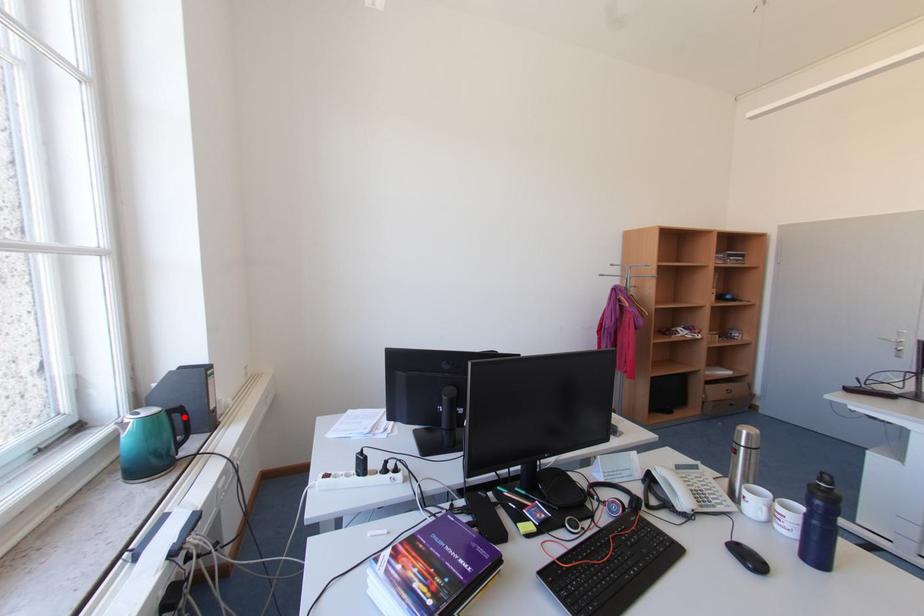
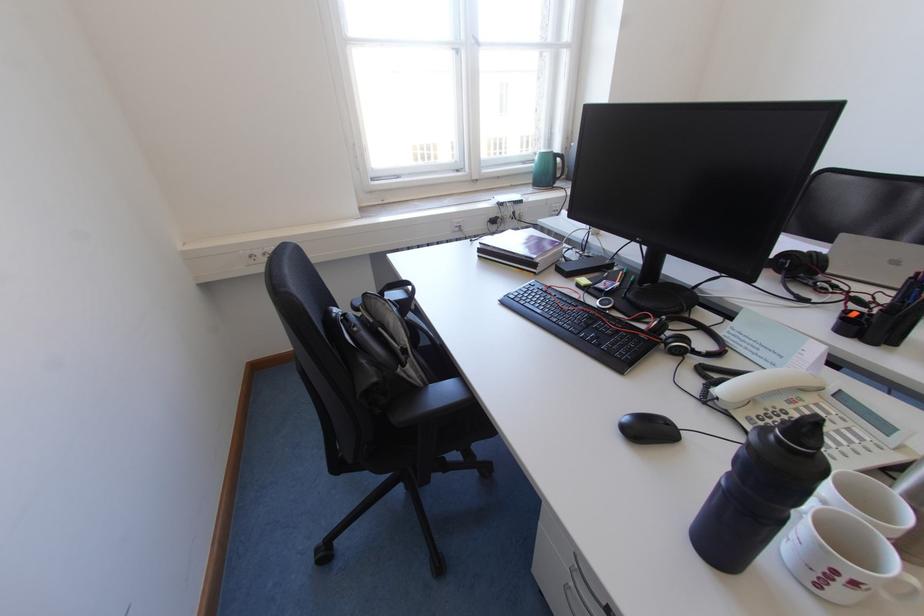
Question: I am providing you with two images of the same scene from different viewpoints. Given a red point in image1, look at the same physical point in image2. Is it:

Choices:
 (A) Closer to the viewpoint
 (B) Farther from the viewpoint

Answer: (A)